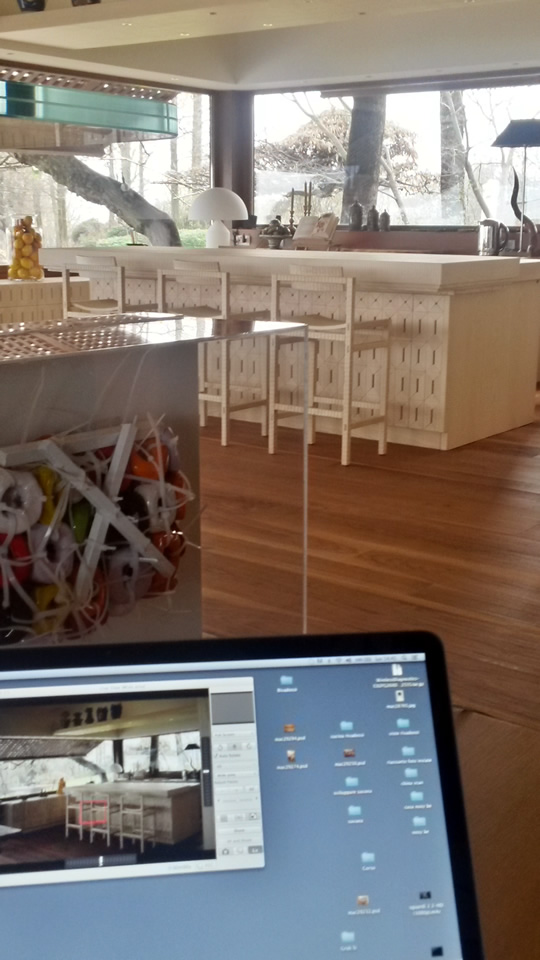
The image size is (540, 960). In order to click on kettle in this screenshot , I will do `click(492, 237)`.